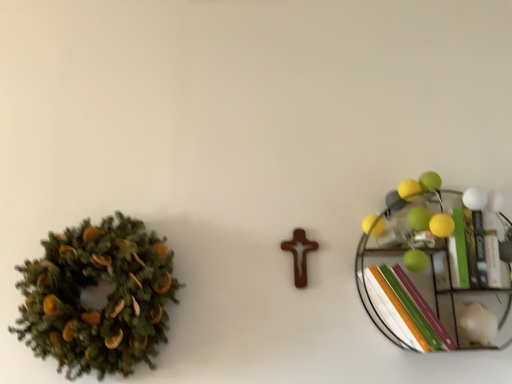
Question: Considering the relative positions of green matte book at right and green matte wreath at left in the image provided, is green matte book at right to the right of green matte wreath at left from the viewer's perspective?

Choices:
 (A) yes
 (B) no

Answer: (A)

Question: Does green matte book at right have a lesser width compared to green matte wreath at left?

Choices:
 (A) no
 (B) yes

Answer: (A)

Question: Is green matte book at right shorter than green matte wreath at left?

Choices:
 (A) no
 (B) yes

Answer: (B)

Question: Is green matte book at right completely or partially outside of green matte wreath at left?

Choices:
 (A) yes
 (B) no

Answer: (A)

Question: Is green matte book at right positioned behind green matte wreath at left?

Choices:
 (A) yes
 (B) no

Answer: (A)

Question: Considering the positions of metallic wire shelf at right and green matte wreath at left in the image, is metallic wire shelf at right wider or thinner than green matte wreath at left?

Choices:
 (A) wide
 (B) thin

Answer: (B)

Question: Choose the correct answer: Is metallic wire shelf at right inside green matte wreath at left or outside it?

Choices:
 (A) inside
 (B) outside

Answer: (B)

Question: Is metallic wire shelf at right in front of or behind green matte wreath at left in the image?

Choices:
 (A) behind
 (B) front

Answer: (A)

Question: From their relative heights in the image, would you say metallic wire shelf at right is taller or shorter than green matte wreath at left?

Choices:
 (A) tall
 (B) short

Answer: (B)

Question: Is point (148, 362) positioned closer to the camera than point (395, 309)?

Choices:
 (A) closer
 (B) farther

Answer: (B)

Question: Is green matte wreath at left inside or outside of metallic wire shelf at right?

Choices:
 (A) inside
 (B) outside

Answer: (B)

Question: From a real-world perspective, is green matte wreath at left physically located above or below metallic wire shelf at right?

Choices:
 (A) below
 (B) above

Answer: (A)

Question: From their relative heights in the image, would you say green matte wreath at left is taller or shorter than metallic wire shelf at right?

Choices:
 (A) short
 (B) tall

Answer: (B)

Question: From a real-world perspective, is green matte wreath at left positioned above or below green matte book at right?

Choices:
 (A) above
 (B) below

Answer: (B)

Question: In the image, is green matte wreath at left positioned in front of or behind green matte book at right?

Choices:
 (A) behind
 (B) front

Answer: (B)